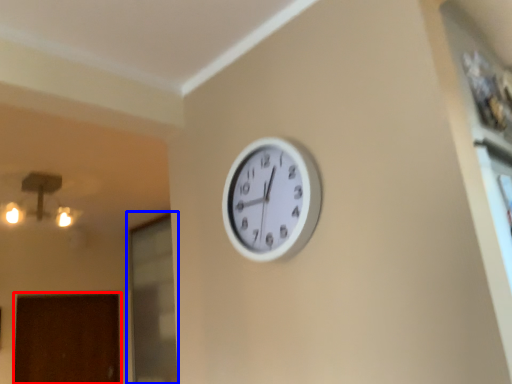
Question: Which of the following is the farthest to the observer, door (highlighted by a red box) or glass door (highlighted by a blue box)?

Choices:
 (A) door
 (B) glass door

Answer: (A)